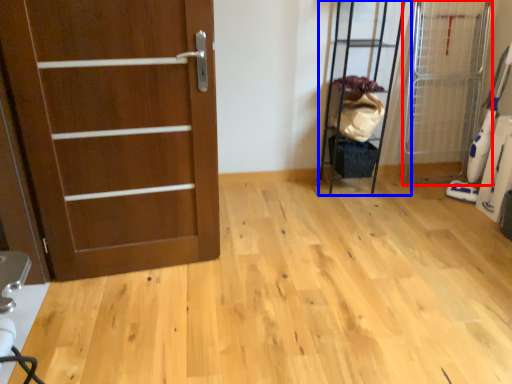
Question: Which object is further to the camera taking this photo, elevator (highlighted by a red box) or elevator (highlighted by a blue box)?

Choices:
 (A) elevator
 (B) elevator

Answer: (B)